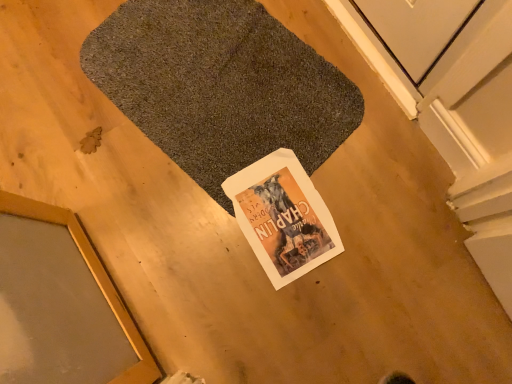
Identify the location of free space in front of dark gray carpet at center. tap(270, 253).